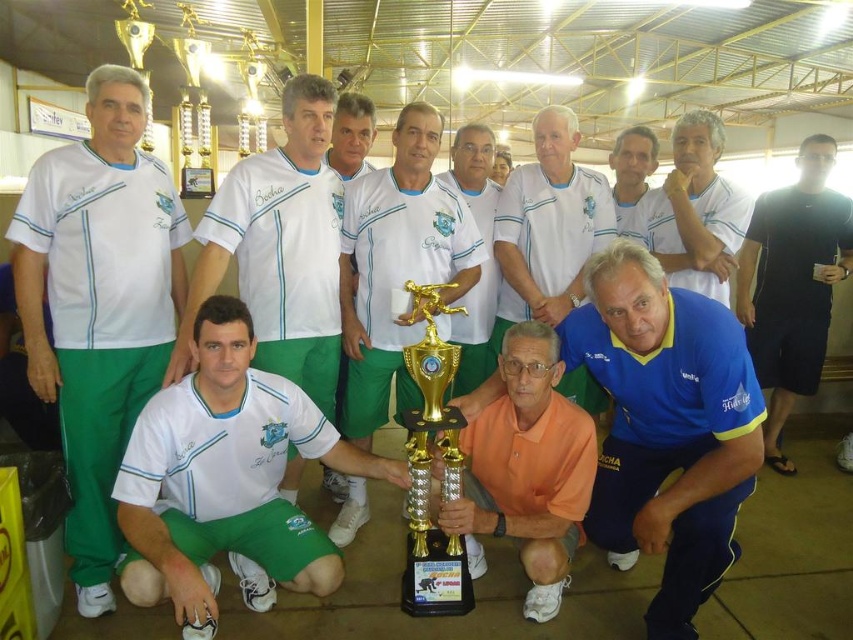
In the group photo taken in the sports hall, you notice two central figures wearing a blue jersey at center and a white matte shirt at center. From the perspective of someone standing in front of the photo, which clothing item is positioned lower?

The blue jersey at center is located below the white matte shirt at center, so the blue jersey at center is positioned lower.

In the image of the sports team, there is an orange matte shirt at center and a white matte shirt at center. Which shirt is shorter in height?

The orange matte shirt at center is shorter in height than the white matte shirt at center.